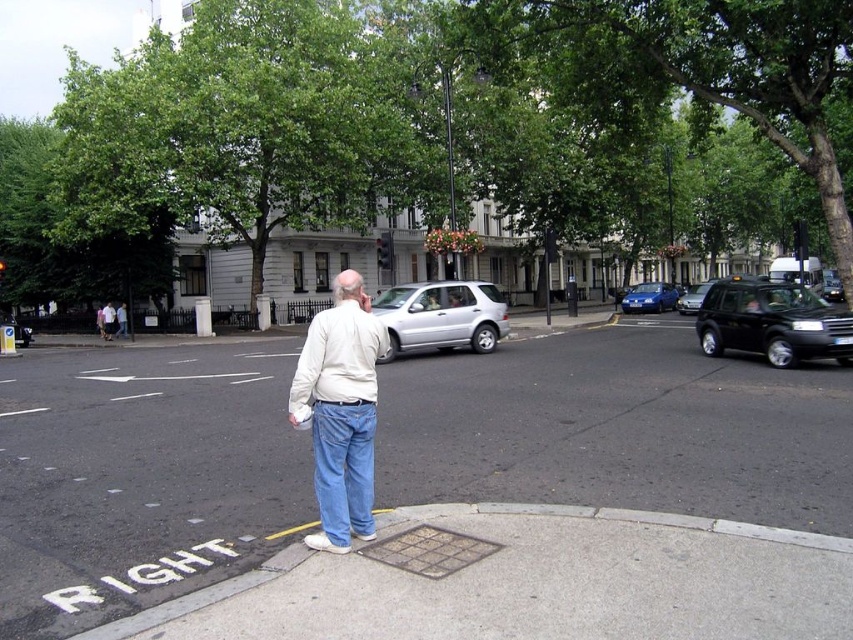
Which of these two, white cotton shirt at center or metallic blue hatchback at right, stands taller?

white cotton shirt at center is taller.

Does white cotton shirt at center have a lesser height compared to metallic blue hatchback at right?

No.

At what (x,y) coordinates should I click in order to perform the action: click on white cotton shirt at center. Please return your answer as a coordinate pair (x, y). The height and width of the screenshot is (640, 853). Looking at the image, I should click on (341, 412).

Can you confirm if white matte car at center is positioned to the left of shiny black suv at right?

Indeed, white matte car at center is positioned on the left side of shiny black suv at right.

Consider the image. Is white matte car at center shorter than shiny black suv at right?

Indeed, white matte car at center has a lesser height compared to shiny black suv at right.

Identify the location of white matte car at center. (432, 496).

Between white matte car at center and black metallic taxi at right, which one has less height?

white matte car at center is shorter.

Image resolution: width=853 pixels, height=640 pixels. Describe the element at coordinates (432, 496) in the screenshot. I see `white matte car at center` at that location.

Is point (287, 340) more distant than point (701, 296)?

No, (287, 340) is closer to viewer.

Identify the location of white matte car at center. This screenshot has width=853, height=640. (432, 496).